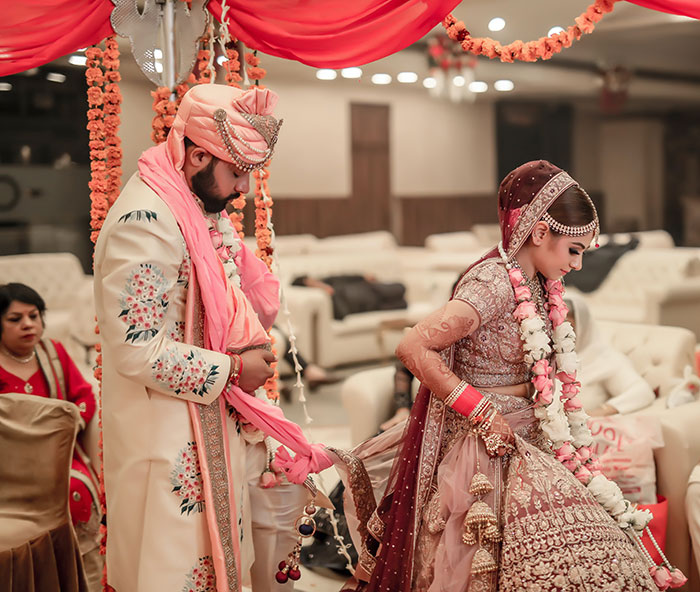
The height and width of the screenshot is (592, 700). What are the coordinates of `door` in the screenshot? It's located at (371, 138).